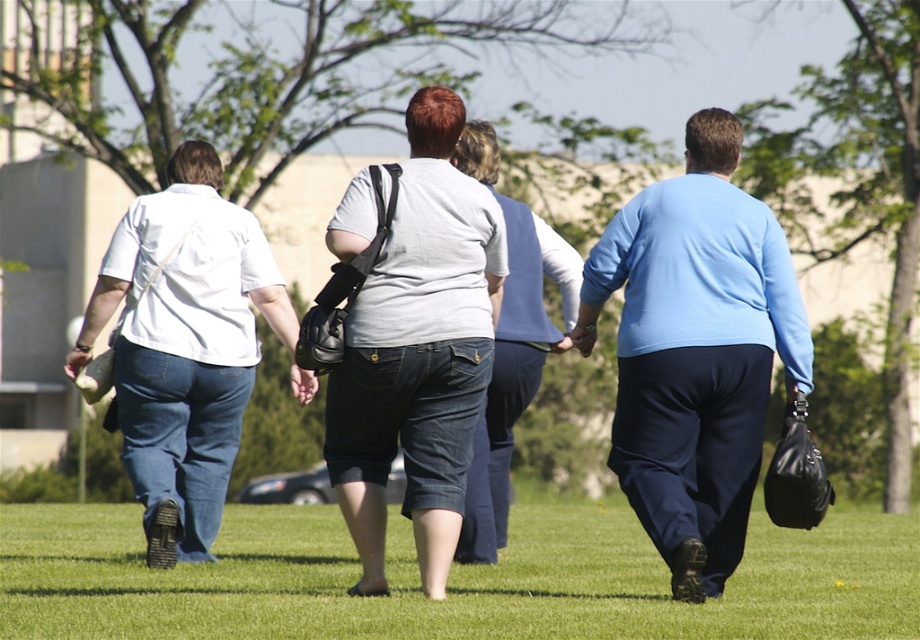
This screenshot has height=640, width=920. In order to click on matte gray shirt at center in this screenshot , I will do `click(418, 353)`.

Is point (335, 244) in front of point (503, 365)?

Yes, point (335, 244) is closer to viewer.

Who is more forward, (x=401, y=378) or (x=481, y=492)?

Point (x=401, y=378) is in front.

Identify the location of matte gray shirt at center. [x=418, y=353].

Does green grass at lower center come in front of light blue fabric shirt at center?

Yes, it is.

I want to click on green grass at lower center, so click(449, 579).

This screenshot has height=640, width=920. Find the location of `green grass at lower center`. green grass at lower center is located at coordinates (449, 579).

Image resolution: width=920 pixels, height=640 pixels. Identify the location of green grass at lower center. (449, 579).

Which is below, matte black bag at center or denim jeans at left?

matte black bag at center is below.

Can you confirm if matte black bag at center is positioned to the left of denim jeans at left?

In fact, matte black bag at center is to the right of denim jeans at left.

Which is behind, point (397, 419) or point (251, 358)?

Positioned behind is point (251, 358).

You are a GUI agent. You are given a task and a screenshot of the screen. Output one action in this format:
    pyautogui.click(x=<x>, y=<y>)
    Task: Click on the matte black bag at center
    The image size is (920, 640).
    Given the screenshot: What is the action you would take?
    pyautogui.click(x=409, y=346)